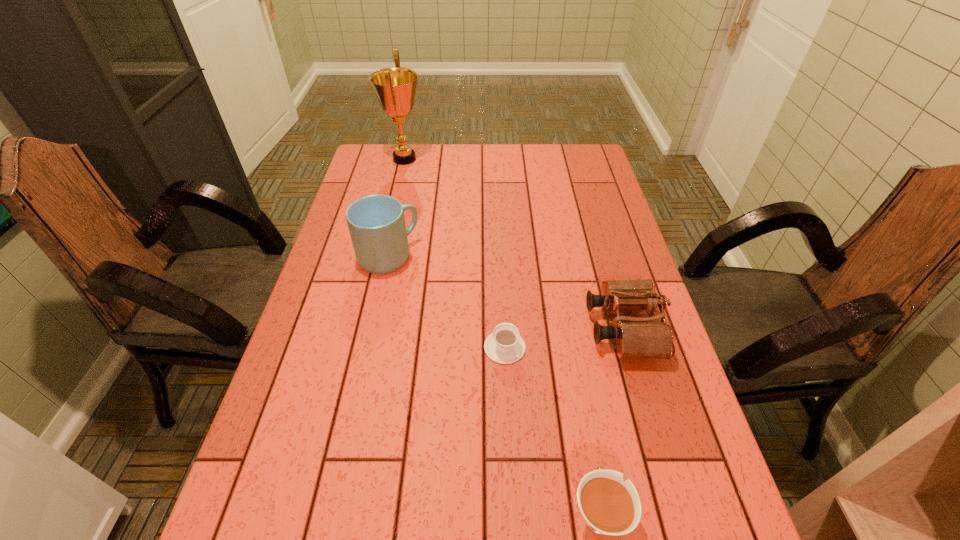
This screenshot has height=540, width=960. Find the location of `the tallest object`. the tallest object is located at coordinates (395, 88).

Locate an element on the screen. The image size is (960, 540). award is located at coordinates (395, 88).

Image resolution: width=960 pixels, height=540 pixels. Find the location of `the fourth shortest object`. the fourth shortest object is located at coordinates (376, 223).

The height and width of the screenshot is (540, 960). I want to click on mug, so click(x=376, y=223).

At what (x,y) coordinates should I click in order to perform the action: click on the rightmost object. Please return your answer as a coordinate pair (x, y). Looking at the image, I should click on (638, 337).

Locate an element on the screen. The height and width of the screenshot is (540, 960). the third tallest object is located at coordinates (638, 337).

In order to click on the shorter teacup in this screenshot , I will do `click(505, 345)`.

Where is `the third object from left to right`? The height and width of the screenshot is (540, 960). the third object from left to right is located at coordinates (505, 345).

The width and height of the screenshot is (960, 540). I want to click on free location located 0.110m on the front view with handles of the farthest object, so click(455, 159).

This screenshot has width=960, height=540. In order to click on free space located on the front of the second farthest object in this screenshot , I will do `click(371, 337)`.